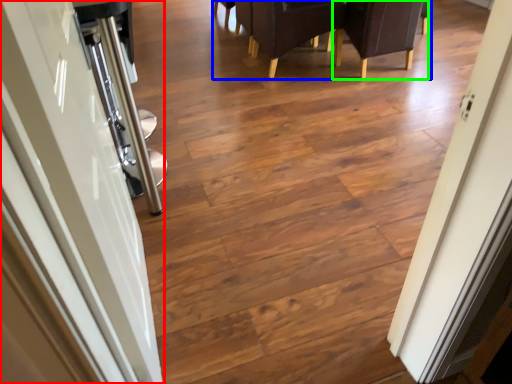
Question: Considering the real-world distances, which object is closest to door (highlighted by a red box)? furniture (highlighted by a blue box) or armchair (highlighted by a green box).

Choices:
 (A) furniture
 (B) armchair

Answer: (A)